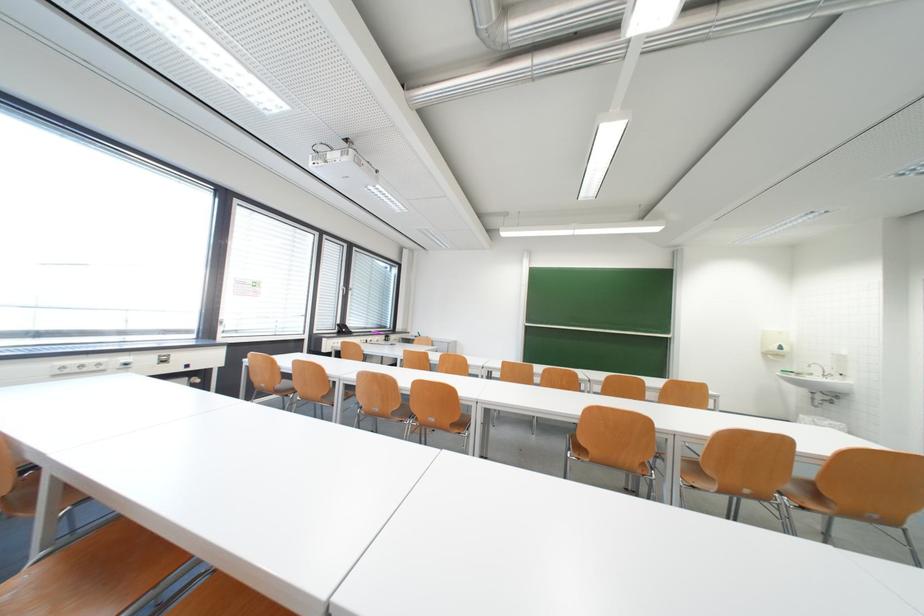
Locate an element on the screen. The height and width of the screenshot is (616, 924). black window handle is located at coordinates (346, 290).